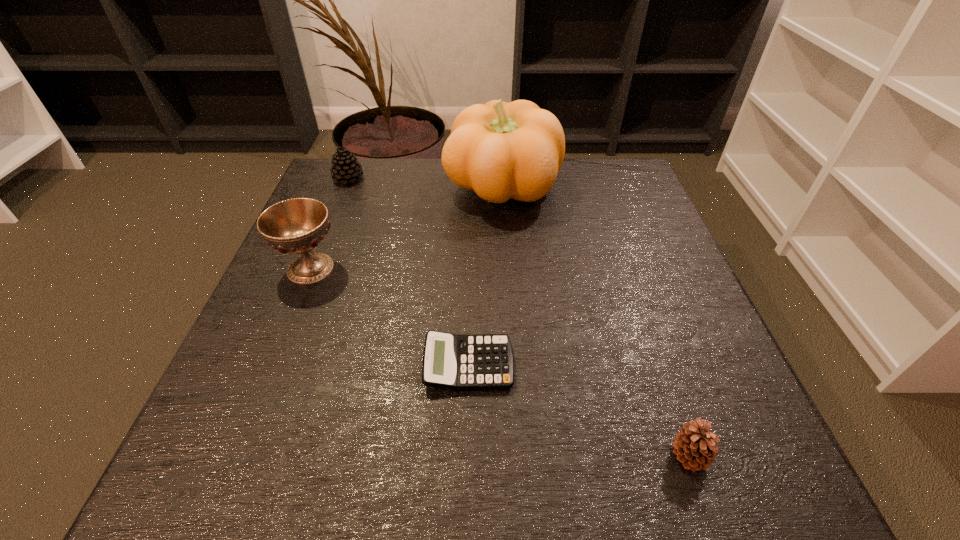
At what (x,y) coordinates should I click in order to perform the action: click on object that is at the near right corner. Please return your answer as a coordinate pair (x, y). The image size is (960, 540). Looking at the image, I should click on (694, 445).

In the image, there is a desktop. Identify the location of vacant space at the far edge. (549, 198).

Find the location of `vacant space at the left edge`. vacant space at the left edge is located at coordinates (291, 421).

Where is `vacant space at the right edge of the desktop`? This screenshot has width=960, height=540. vacant space at the right edge of the desktop is located at coordinates (698, 301).

At what (x,y) coordinates should I click in order to perform the action: click on free space at the far left corner of the desktop. Please return your answer as a coordinate pair (x, y). Image resolution: width=960 pixels, height=540 pixels. Looking at the image, I should click on (363, 182).

In order to click on vacant space at the far right corner in this screenshot , I will do `click(638, 190)`.

This screenshot has height=540, width=960. In the image, there is a desktop. What are the coordinates of `vacant space at the near right corner` in the screenshot? It's located at (748, 444).

The height and width of the screenshot is (540, 960). I want to click on vacant space that is in between the nearer pinecone and the calculator, so click(579, 410).

What are the coordinates of `free space between the tallest object and the fourth shortest object` in the screenshot? It's located at (406, 228).

The width and height of the screenshot is (960, 540). In order to click on empty space between the second tallest object and the pumpkin in this screenshot , I will do `click(406, 228)`.